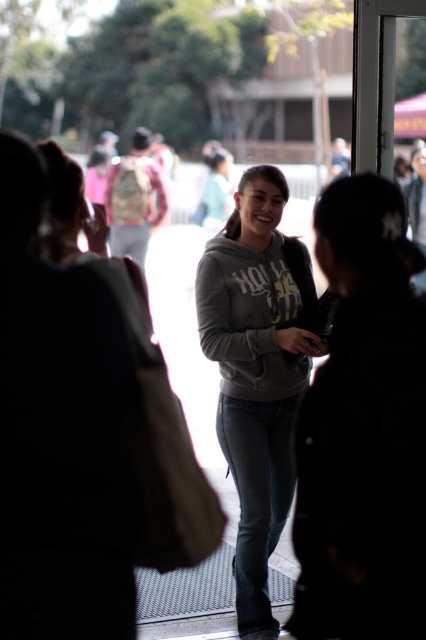
Question: Can you confirm if gray matte hoodie at center is smaller than gray fleece sweatshirt at center?

Choices:
 (A) no
 (B) yes

Answer: (A)

Question: From the image, what is the correct spatial relationship of gray matte hoodie at center in relation to gray fleece sweatshirt at center?

Choices:
 (A) above
 (B) below

Answer: (B)

Question: Is gray matte hoodie at center below gray fleece sweatshirt at center?

Choices:
 (A) no
 (B) yes

Answer: (B)